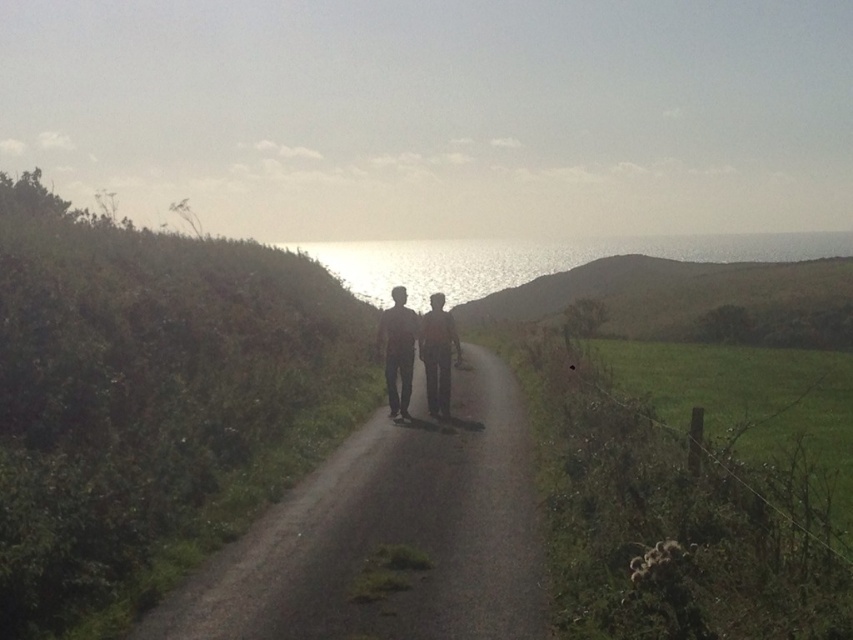
Between point (695, 276) and point (395, 332), which one is positioned in front?

Point (395, 332) is in front.

Looking at this image, who is shorter, green grassy hillside at upper center or matte black pants at center?

Standing shorter between the two is matte black pants at center.

The image size is (853, 640). I want to click on green grassy hillside at upper center, so click(686, 298).

Who is taller, dull gray asphalt road at center or matte black pants at center?

matte black pants at center

Image resolution: width=853 pixels, height=640 pixels. What are the coordinates of `dull gray asphalt road at center` in the screenshot? It's located at (387, 536).

Between dull gray asphalt road at center and green grassy hillside at upper center, which one is positioned higher?

green grassy hillside at upper center

The width and height of the screenshot is (853, 640). What do you see at coordinates (387, 536) in the screenshot?
I see `dull gray asphalt road at center` at bounding box center [387, 536].

Where is `dull gray asphalt road at center`? The height and width of the screenshot is (640, 853). dull gray asphalt road at center is located at coordinates (387, 536).